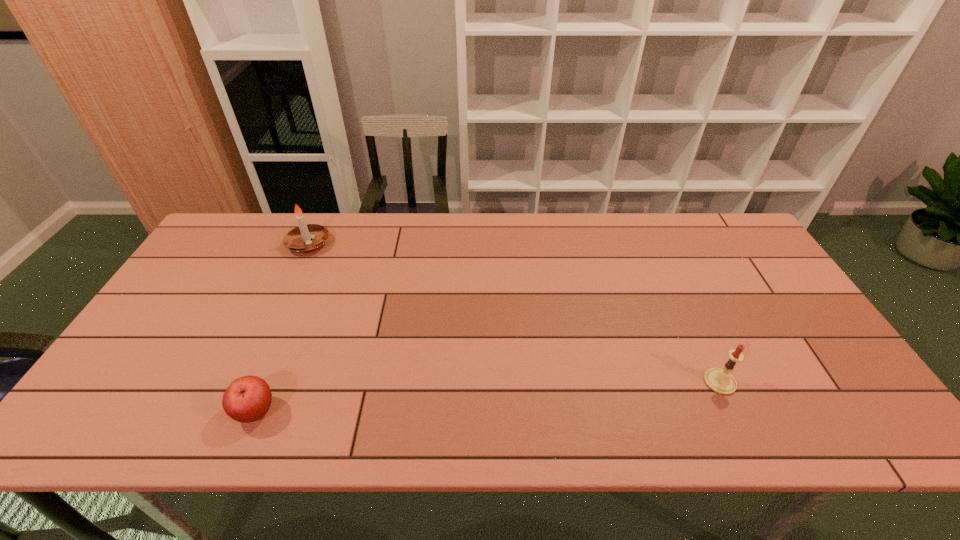
Find the location of a particular element. The width and height of the screenshot is (960, 540). free space between the left candle and the right candle is located at coordinates (515, 313).

You are a GUI agent. You are given a task and a screenshot of the screen. Output one action in this format:
    pyautogui.click(x=<x>, y=<y>)
    Task: Click on the vacant point located between the left candle and the right candle
    This screenshot has width=960, height=540.
    Given the screenshot: What is the action you would take?
    pyautogui.click(x=515, y=313)

This screenshot has width=960, height=540. Identify the location of free space between the left candle and the rightmost object. (515, 313).

At what (x,y) coordinates should I click in order to perform the action: click on vacant region between the shortest object and the farther candle. Please return your answer as a coordinate pair (x, y). The height and width of the screenshot is (540, 960). Looking at the image, I should click on (282, 328).

Identify the location of empty space that is in between the apple and the nearer candle. (488, 396).

At what (x,y) coordinates should I click in order to perform the action: click on vacant space that is in between the rightmost object and the apple. Please return your answer as a coordinate pair (x, y). This screenshot has height=540, width=960. Looking at the image, I should click on (488, 396).

Identify which object is the closest to the right candle. Please provide its 2D coordinates. Your answer should be formatted as a tuple, i.e. [(x, y)], where the tuple contains the x and y coordinates of a point satisfying the conditions above.

[(247, 399)]

Select which object is the second closest to the rightmost object. Please provide its 2D coordinates. Your answer should be formatted as a tuple, i.e. [(x, y)], where the tuple contains the x and y coordinates of a point satisfying the conditions above.

[(307, 238)]

This screenshot has height=540, width=960. I want to click on free region that satisfies the following two spatial constraints: 1. on the front side of the left candle; 2. on the left side of the shortest object, so click(x=232, y=411).

Find the location of a particular element. This screenshot has width=960, height=540. vacant point that satisfies the following two spatial constraints: 1. on the front side of the apple; 2. on the right side of the farther candle is located at coordinates (232, 411).